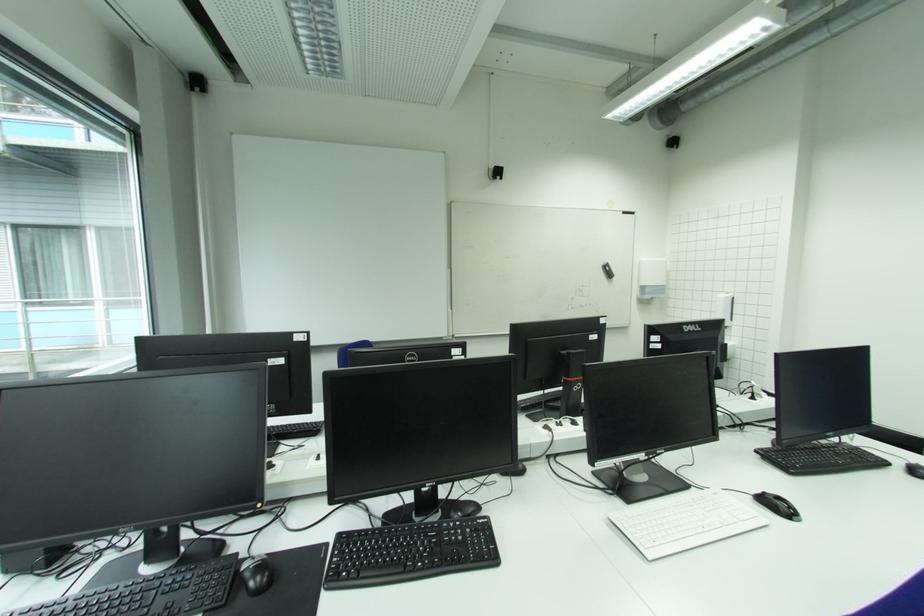
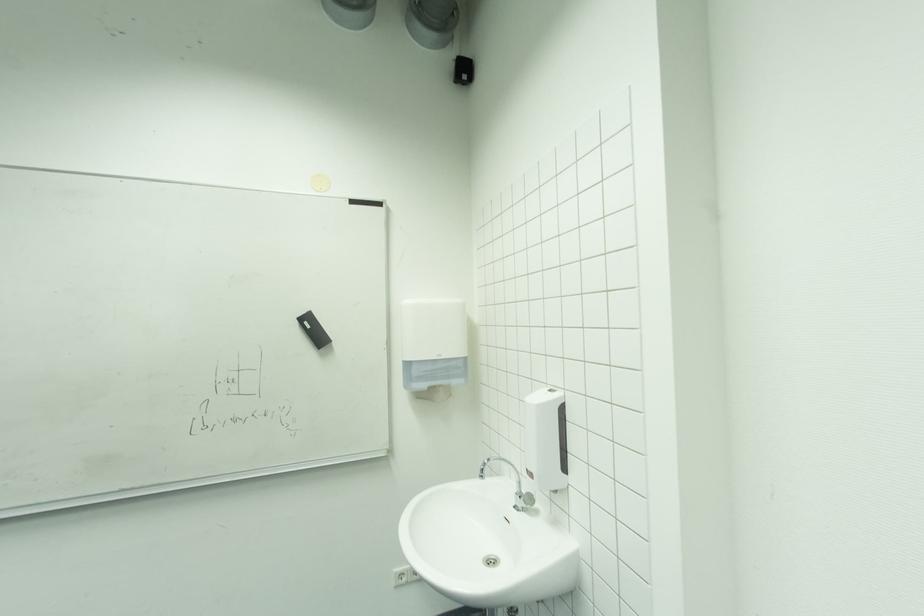
Find the pixel in the second image that matches (649,288) in the first image.

(412, 365)